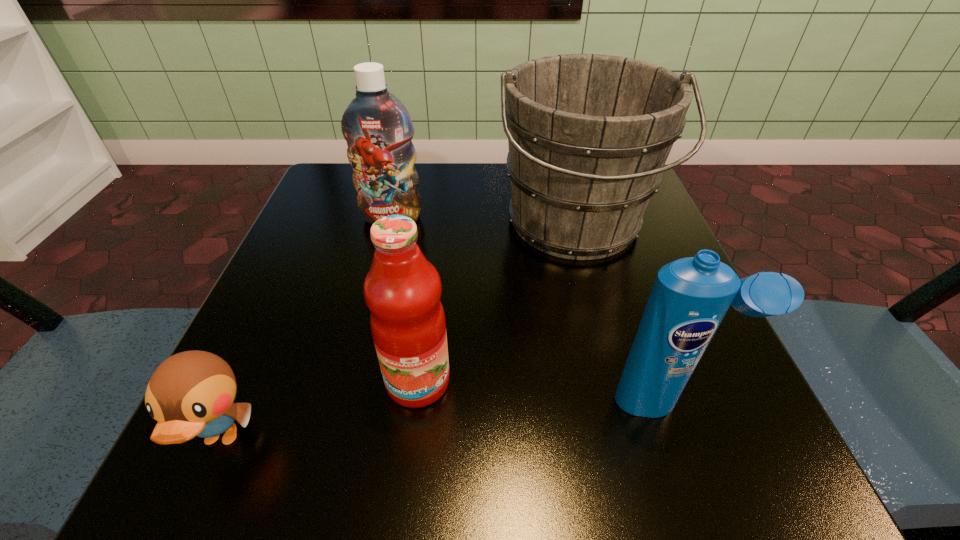
Image resolution: width=960 pixels, height=540 pixels. Find the location of `object present at the far right corner`. object present at the far right corner is located at coordinates (588, 134).

At what (x,y) coordinates should I click in order to perform the action: click on object that is positioned at the near right corner. Please return your answer as a coordinate pair (x, y). The height and width of the screenshot is (540, 960). Looking at the image, I should click on (690, 297).

Identify the location of vacant point at the far edge. Image resolution: width=960 pixels, height=540 pixels. (501, 195).

At what (x,y) coordinates should I click in order to perform the action: click on free space at the near edge of the desktop. Please return your answer as a coordinate pair (x, y). The image size is (960, 540). Looking at the image, I should click on (494, 434).

Locate an element on the screen. The width and height of the screenshot is (960, 540). free point at the left edge is located at coordinates (310, 260).

Locate an element on the screen. vacant space at the near left corner of the desktop is located at coordinates (295, 448).

Find the location of a particular element. The image size is (960, 540). free space between the shorter shampoo and the shortest object is located at coordinates (444, 420).

You are a GUI agent. You are given a task and a screenshot of the screen. Output one action in this format:
    pyautogui.click(x=<x>, y=<y>)
    Task: Click on the free space between the bucket and the nearer shampoo
    This screenshot has width=960, height=540.
    Given the screenshot: What is the action you would take?
    pyautogui.click(x=621, y=313)

The image size is (960, 540). I want to click on free space that is in between the shorter shampoo and the bucket, so [621, 313].

You are a GUI agent. You are given a task and a screenshot of the screen. Output one action in this format:
    pyautogui.click(x=<x>, y=<y>)
    Task: Click on the vacant space that's between the duck and the fruit juice
    
    Given the screenshot: What is the action you would take?
    pyautogui.click(x=320, y=410)